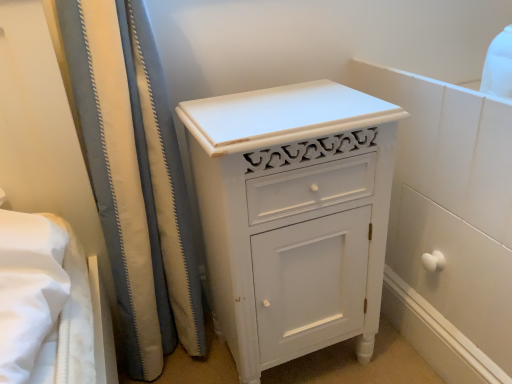
Question: Is white painted wood cabinet at center taller or shorter than white fabric shower curtain at left?

Choices:
 (A) tall
 (B) short

Answer: (B)

Question: Looking at the image, does white painted wood cabinet at center seem bigger or smaller compared to white fabric shower curtain at left?

Choices:
 (A) small
 (B) big

Answer: (A)

Question: Is white painted wood cabinet at center inside or outside of white fabric shower curtain at left?

Choices:
 (A) outside
 (B) inside

Answer: (A)

Question: In the image, is white fabric shower curtain at left positioned in front of or behind white painted wood cabinet at center?

Choices:
 (A) behind
 (B) front

Answer: (B)

Question: Considering the positions of white fabric shower curtain at left and white painted wood cabinet at center in the image, is white fabric shower curtain at left taller or shorter than white painted wood cabinet at center?

Choices:
 (A) short
 (B) tall

Answer: (B)

Question: Is point (55, 3) closer or farther from the camera than point (208, 162)?

Choices:
 (A) farther
 (B) closer

Answer: (A)

Question: Would you say white fabric shower curtain at left is to the left or to the right of white painted wood cabinet at center in the picture?

Choices:
 (A) left
 (B) right

Answer: (A)